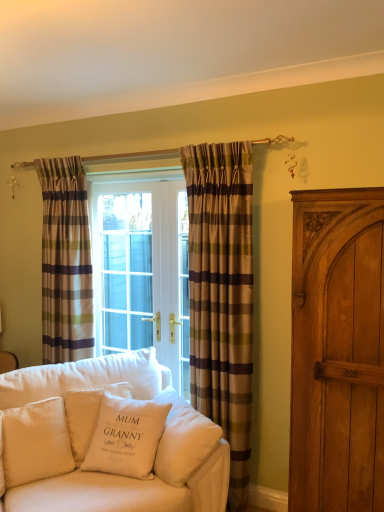
Question: Is point (331, 240) positioned closer to the camera than point (220, 168)?

Choices:
 (A) closer
 (B) farther

Answer: (A)

Question: From the image's perspective, is wooden carved cabinet at right located above or below plaid fabric curtain at center, acting as the 1th curtain starting from the right?

Choices:
 (A) below
 (B) above

Answer: (A)

Question: Based on their relative distances, which object is farther from the white soft cushion at lower left, the 4th pillow viewed from the left?

Choices:
 (A) wooden carved cabinet at right
 (B) white quilted pillow at lower left, the fourth pillow when ordered from right to left
 (C) white cotton pillow at center, the 3th pillow in the left-to-right sequence
 (D) white cotton pillow at center, which is counted as the third pillow, starting from the right
 (E) velvet white couch at center

Answer: (A)

Question: Which object is positioned closest to the white soft cushion at lower left, which appears as the 1th pillow when viewed from the right?

Choices:
 (A) plaid fabric curtain at left, marked as the 1th curtain in a back-to-front arrangement
 (B) white cotton pillow at center, acting as the second pillow starting from the right
 (C) white quilted pillow at lower left, marked as the 1th pillow in a left-to-right arrangement
 (D) wooden carved cabinet at right
 (E) velvet white couch at center

Answer: (B)